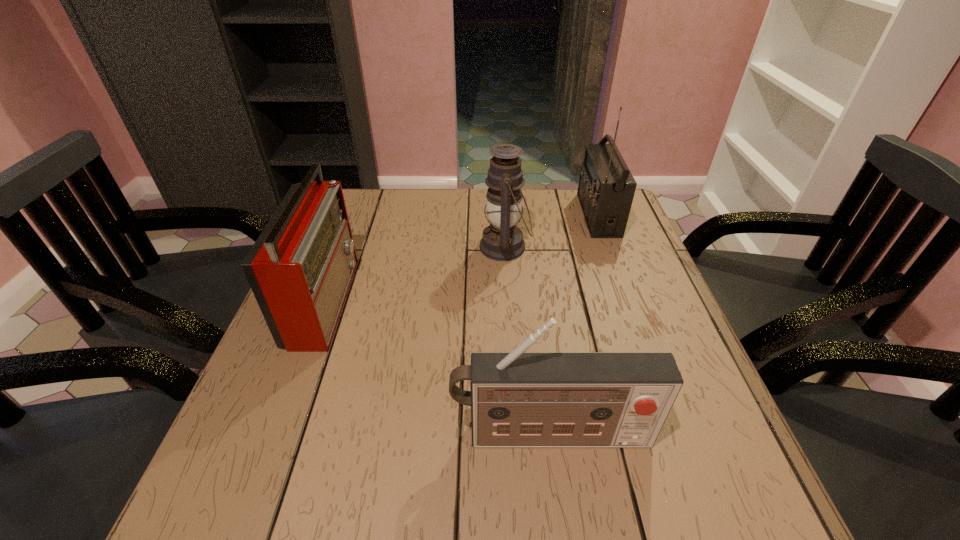
I want to click on the rightmost radio receiver, so click(x=606, y=188).

Find the location of a particular element. This screenshot has width=960, height=540. the rightmost object is located at coordinates (606, 188).

Identify the location of oil lamp. The image size is (960, 540). (502, 240).

Find the location of a particular element. This screenshot has height=540, width=960. the second radio receiver from left to right is located at coordinates (518, 399).

Identify the location of the nearest object. (518, 399).

Image resolution: width=960 pixels, height=540 pixels. I want to click on the leftmost radio receiver, so click(x=300, y=269).

Where is `the leftmost object`? The height and width of the screenshot is (540, 960). the leftmost object is located at coordinates (300, 269).

The width and height of the screenshot is (960, 540). In order to click on vacant area located on the front panel of the farthest radio receiver in this screenshot , I will do `click(487, 215)`.

Locate an element on the screen. The width and height of the screenshot is (960, 540). vacant area situated 0.230m on the front panel of the farthest radio receiver is located at coordinates (506, 215).

Identify the location of vacant area situated on the front panel of the farthest radio receiver. (473, 215).